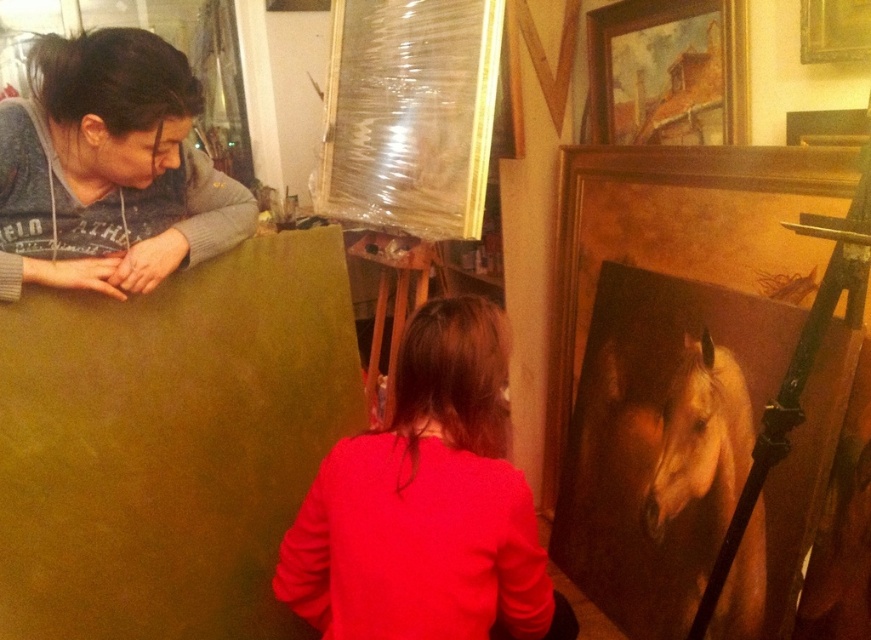
Which of these two, matte red sweater at center or matte gray hoodie at upper left, stands taller?

With more height is matte red sweater at center.

Does point (408, 324) come in front of point (181, 76)?

No, (408, 324) is further to viewer.

At what (x,y) coordinates should I click in order to perform the action: click on matte red sweater at center. Please return your answer as a coordinate pair (x, y). The height and width of the screenshot is (640, 871). Looking at the image, I should click on (424, 502).